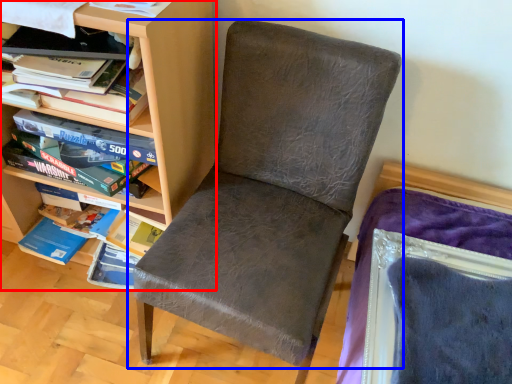
Question: Which object appears closest to the camera in this image, shelf (highlighted by a red box) or chair (highlighted by a blue box)?

Choices:
 (A) shelf
 (B) chair

Answer: (B)